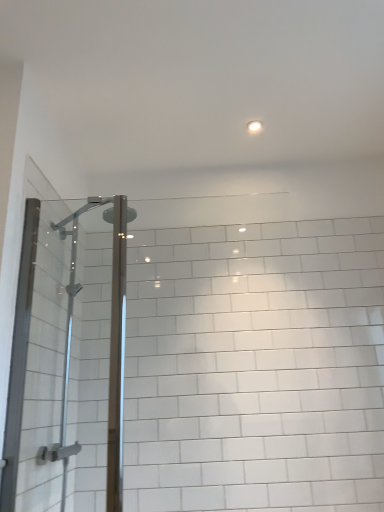
Question: From the image's perspective, is clear glass shower door at left located beneath white glossy light fixture at upper center?

Choices:
 (A) yes
 (B) no

Answer: (A)

Question: Considering the relative positions of clear glass shower door at left and white glossy light fixture at upper center in the image provided, is clear glass shower door at left behind white glossy light fixture at upper center?

Choices:
 (A) no
 (B) yes

Answer: (A)

Question: From a real-world perspective, is clear glass shower door at left physically above white glossy light fixture at upper center?

Choices:
 (A) no
 (B) yes

Answer: (A)

Question: Considering the relative sizes of clear glass shower door at left and white glossy light fixture at upper center in the image provided, is clear glass shower door at left wider than white glossy light fixture at upper center?

Choices:
 (A) yes
 (B) no

Answer: (A)

Question: Is clear glass shower door at left located outside white glossy light fixture at upper center?

Choices:
 (A) no
 (B) yes

Answer: (B)

Question: Does clear glass shower door at left have a lesser height compared to white glossy light fixture at upper center?

Choices:
 (A) yes
 (B) no

Answer: (B)

Question: Considering the relative positions of white glossy light fixture at upper center and clear glass shower door at left in the image provided, is white glossy light fixture at upper center behind clear glass shower door at left?

Choices:
 (A) yes
 (B) no

Answer: (A)

Question: Is white glossy light fixture at upper center directly adjacent to clear glass shower door at left?

Choices:
 (A) yes
 (B) no

Answer: (B)

Question: Is white glossy light fixture at upper center shorter than clear glass shower door at left?

Choices:
 (A) no
 (B) yes

Answer: (B)

Question: Is clear glass shower door at left at the back of white glossy light fixture at upper center?

Choices:
 (A) yes
 (B) no

Answer: (B)

Question: Considering the relative sizes of white glossy light fixture at upper center and clear glass shower door at left in the image provided, is white glossy light fixture at upper center smaller than clear glass shower door at left?

Choices:
 (A) yes
 (B) no

Answer: (A)

Question: Could you tell me if white glossy light fixture at upper center is facing clear glass shower door at left?

Choices:
 (A) yes
 (B) no

Answer: (B)

Question: Visually, is clear glass shower door at left positioned to the left or to the right of white glossy light fixture at upper center?

Choices:
 (A) right
 (B) left

Answer: (B)